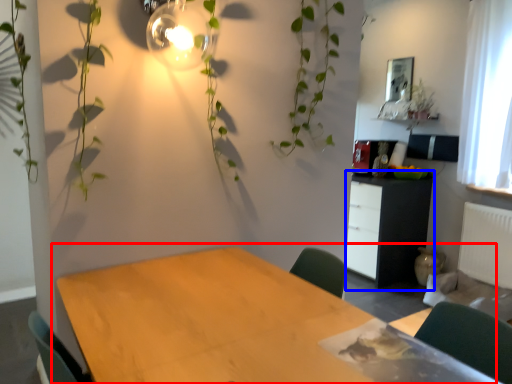
Question: Which of the following is the farthest to the observer, table (highlighted by a red box) or cabinetry (highlighted by a blue box)?

Choices:
 (A) table
 (B) cabinetry

Answer: (B)